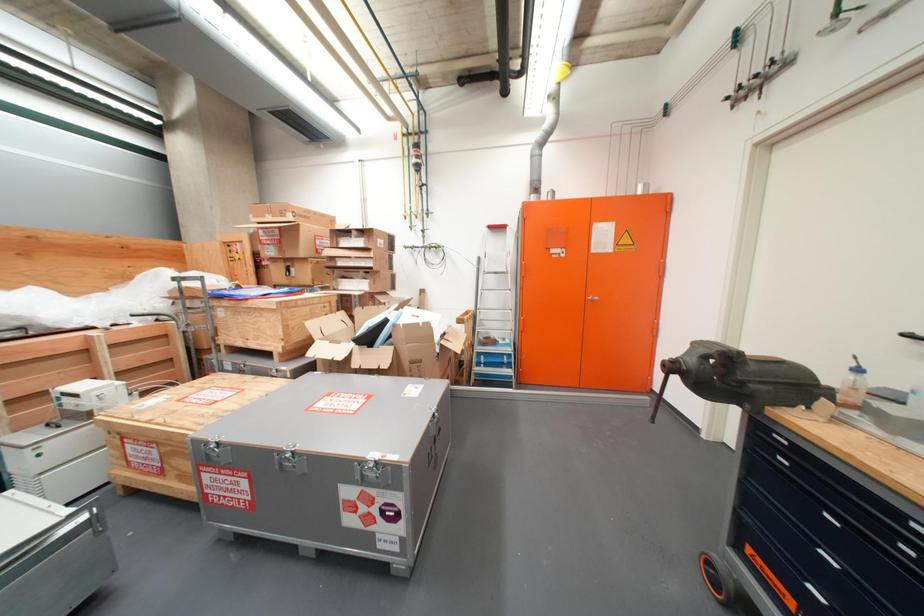
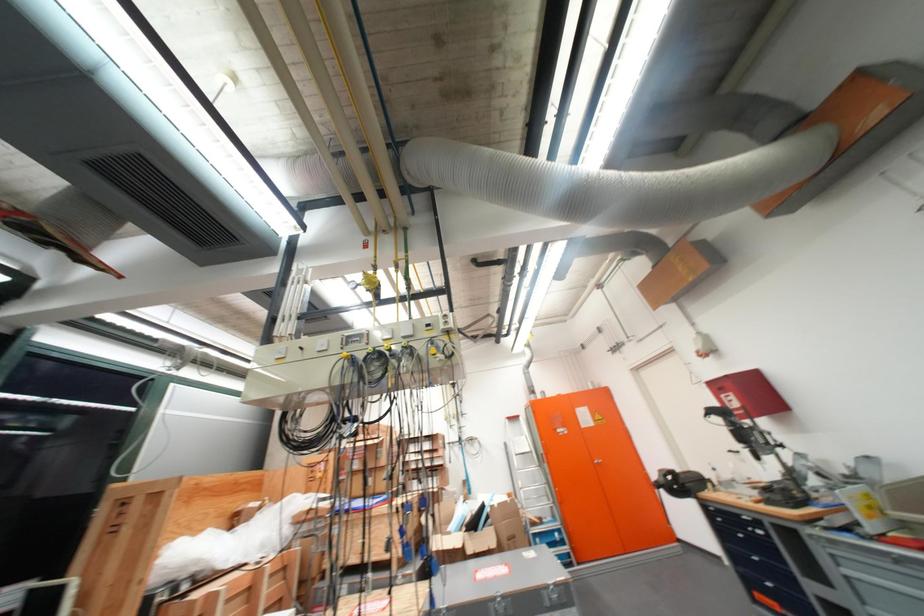
Find the pixel in the second image that matches (622,249) in the first image.

(603, 424)